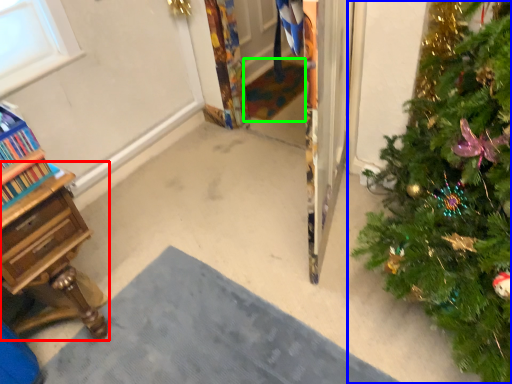
Question: Considering the real-world distances, which object is farthest from desk (highlighted by a red box)? christmas tree (highlighted by a blue box) or doormat (highlighted by a green box)?

Choices:
 (A) christmas tree
 (B) doormat

Answer: (B)